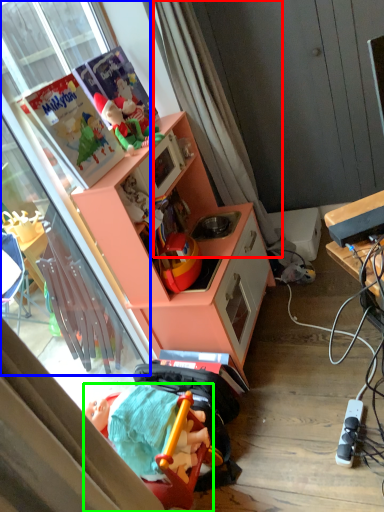
Question: Which object is positioned farthest from curtain (highlighted by a red box)? Select from glass door (highlighted by a blue box) and toy (highlighted by a green box).

Choices:
 (A) glass door
 (B) toy

Answer: (B)